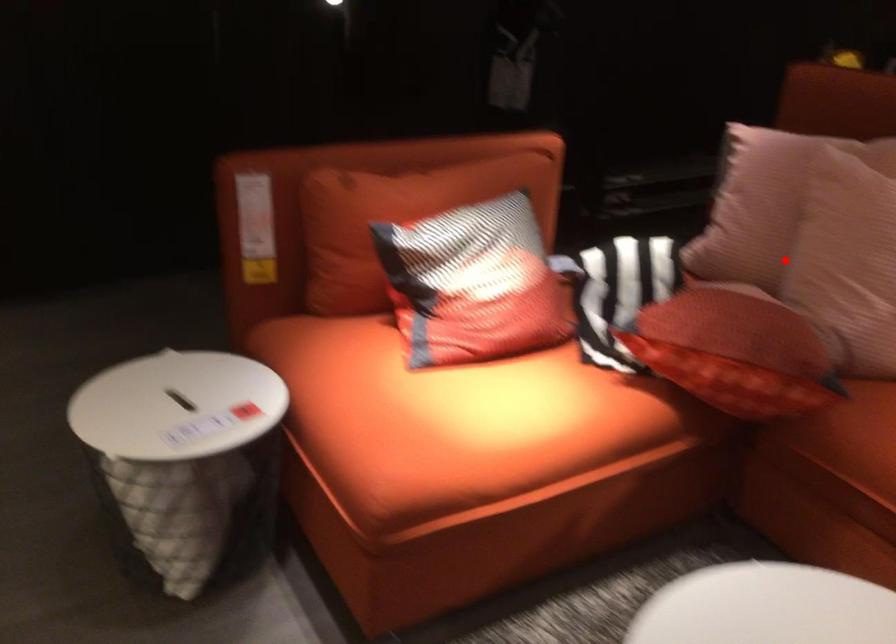
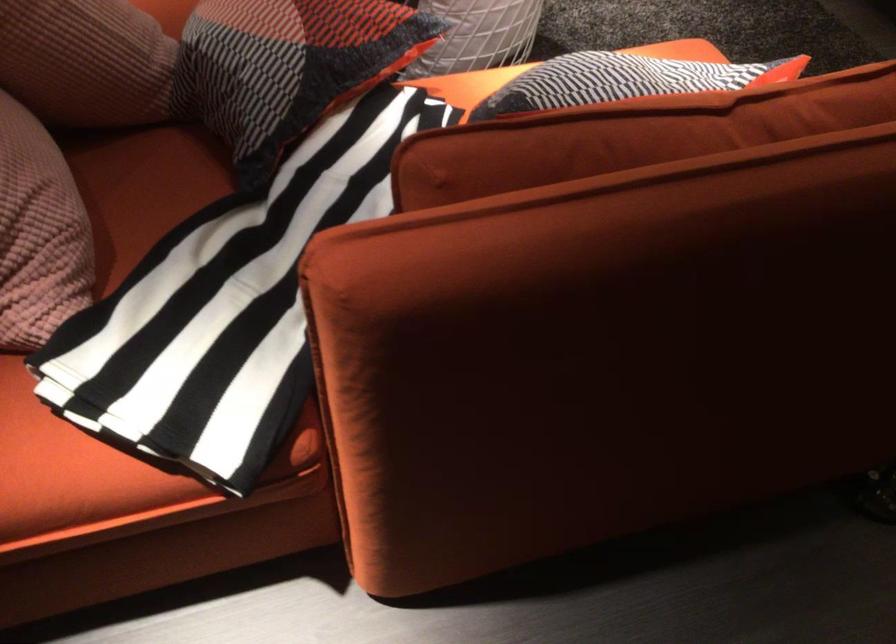
Question: I am providing you with two images of the same scene from different viewpoints. Image1 has a red point marked. In image2, the corresponding 3D location appears at what relative position? Reply with the corresponding letter.

Choices:
 (A) Closer
 (B) Farther

Answer: (A)